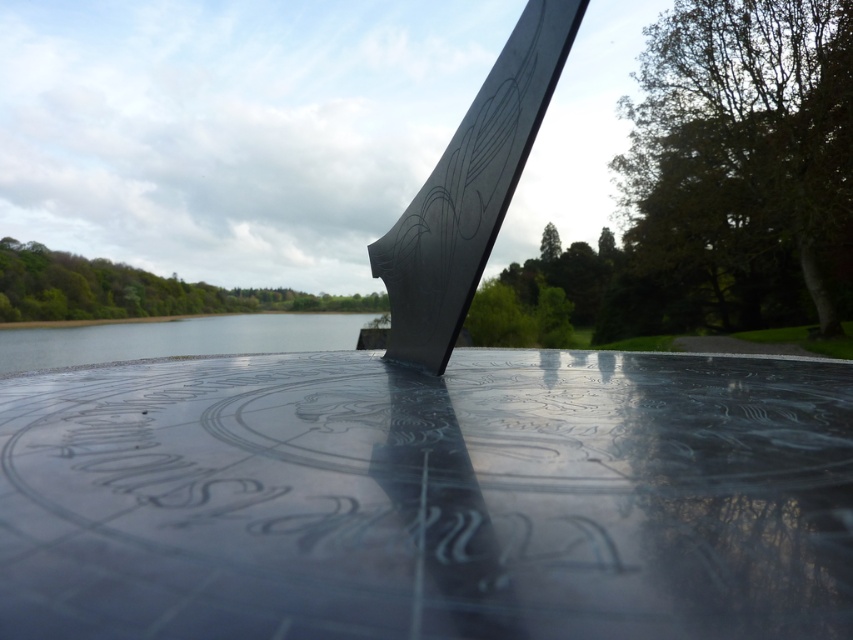
Question: Is black polished metal blade at center bigger than clear water at lower left?

Choices:
 (A) yes
 (B) no

Answer: (B)

Question: Which point is farther from the camera taking this photo?

Choices:
 (A) (126, 355)
 (B) (428, 323)

Answer: (A)

Question: Which object is farther from the camera taking this photo?

Choices:
 (A) black polished metal blade at center
 (B) clear water at lower left

Answer: (B)

Question: Is black polished metal blade at center positioned behind clear water at lower left?

Choices:
 (A) no
 (B) yes

Answer: (A)

Question: Can you confirm if black polished metal blade at center is wider than clear water at lower left?

Choices:
 (A) no
 (B) yes

Answer: (A)